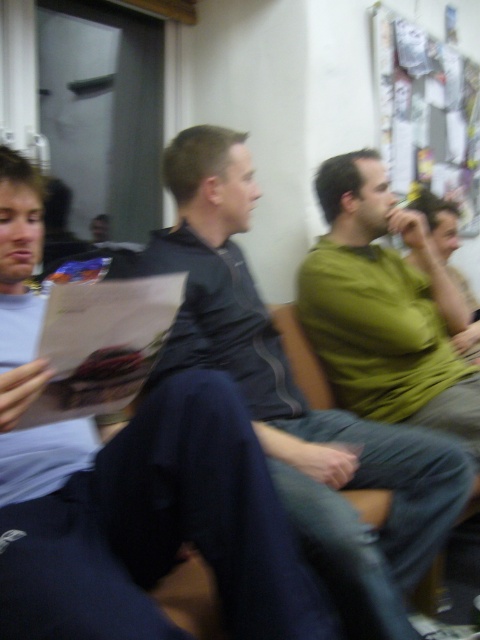
Question: Can you confirm if dark gray shirt at center is smaller than green matte shirt at center?

Choices:
 (A) no
 (B) yes

Answer: (A)

Question: Based on their relative distances, which object is farther from the dark gray shirt at center?

Choices:
 (A) green matte shirt at center
 (B) dark gray fabric shirt at center

Answer: (A)

Question: Is dark gray shirt at center smaller than dark gray fabric shirt at center?

Choices:
 (A) yes
 (B) no

Answer: (A)

Question: Which object is farther from the camera taking this photo?

Choices:
 (A) dark gray fabric shirt at center
 (B) green matte shirt at center

Answer: (B)

Question: Does dark gray fabric shirt at center have a lesser width compared to green matte shirt at center?

Choices:
 (A) yes
 (B) no

Answer: (B)

Question: Which object is closer to the camera taking this photo?

Choices:
 (A) dark gray fabric shirt at center
 (B) dark gray shirt at center
 (C) green matte shirt at center

Answer: (B)